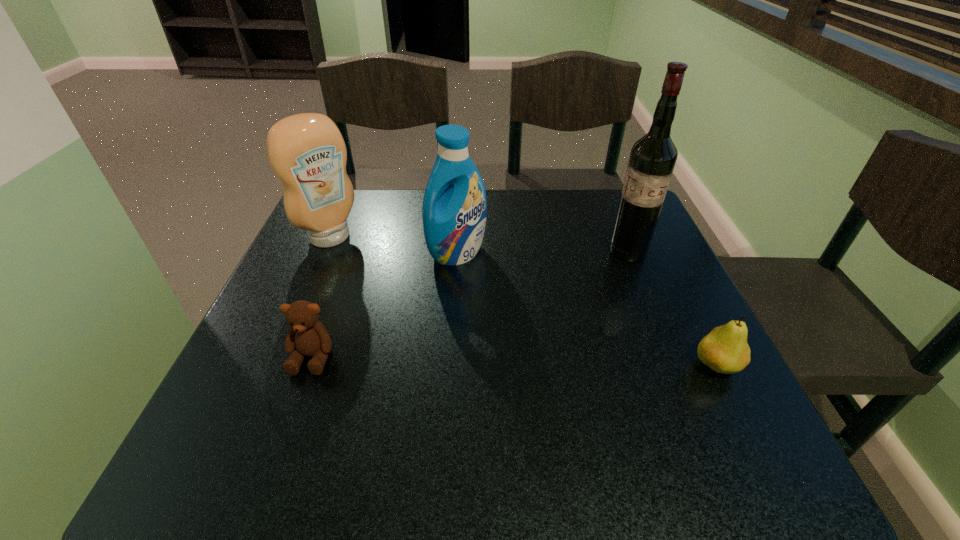
The image size is (960, 540). I want to click on blank space located on the front-facing side of the detergent, so click(489, 280).

Locate an element on the screen. free region located 0.300m on the front-facing side of the detergent is located at coordinates point(563,349).

Image resolution: width=960 pixels, height=540 pixels. I want to click on vacant space positioned on the front-facing side of the detergent, so click(x=597, y=382).

Image resolution: width=960 pixels, height=540 pixels. What are the coordinates of `vacant area situated on the label of the condiment` in the screenshot? It's located at (399, 300).

The width and height of the screenshot is (960, 540). I want to click on vacant region located on the label of the condiment, so click(x=450, y=347).

The height and width of the screenshot is (540, 960). What are the coordinates of `vacant space located on the label of the condiment` in the screenshot? It's located at (416, 316).

Locate an element on the screen. object that is at the far edge is located at coordinates (307, 153).

Where is `object positioned at the near edge`? The width and height of the screenshot is (960, 540). object positioned at the near edge is located at coordinates click(x=725, y=350).

Locate an element on the screen. This screenshot has width=960, height=540. teddy bear located at the left edge is located at coordinates point(307,337).

This screenshot has width=960, height=540. I want to click on condiment present at the left edge, so click(x=307, y=153).